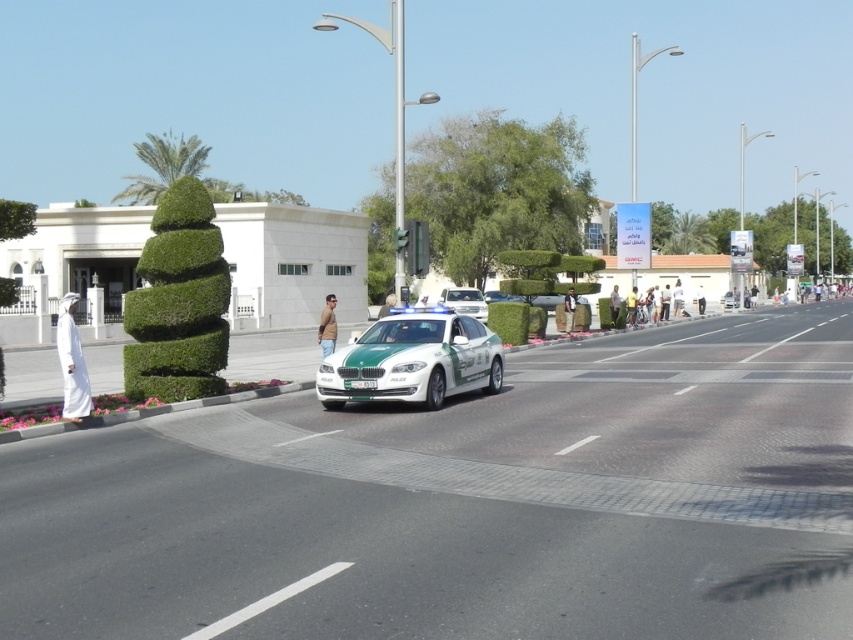
Locate an element on the screen. green matte police car at center is located at coordinates (413, 360).

Between green matte police car at center and white glossy sedan at center, which one has more height?

With more height is white glossy sedan at center.

The height and width of the screenshot is (640, 853). What do you see at coordinates (413, 360) in the screenshot? I see `green matte police car at center` at bounding box center [413, 360].

Identify the location of green matte police car at center. This screenshot has width=853, height=640. (413, 360).